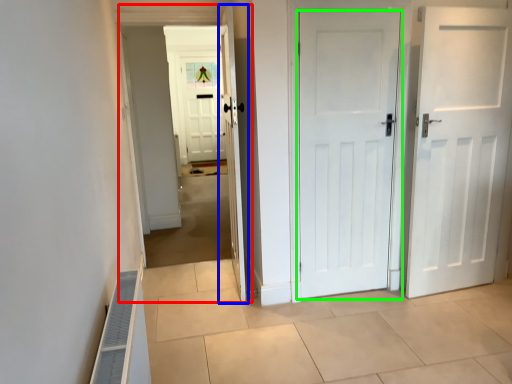
Question: Based on their relative distances, which object is farther from corridor (highlighted by a red box)? Choose from door (highlighted by a blue box) and door (highlighted by a green box).

Choices:
 (A) door
 (B) door

Answer: (B)